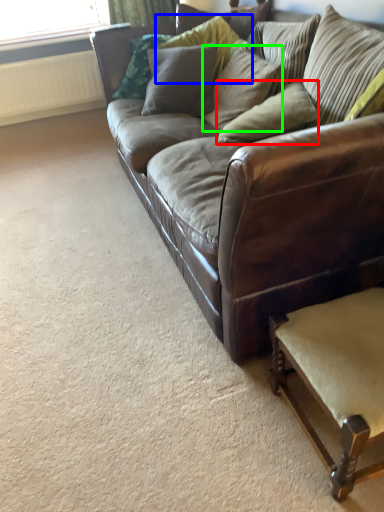
Question: Based on their relative distances, which object is farther from pillow (highlighted by a red box)? Choose from pillow (highlighted by a blue box) and pillow (highlighted by a green box).

Choices:
 (A) pillow
 (B) pillow

Answer: (A)